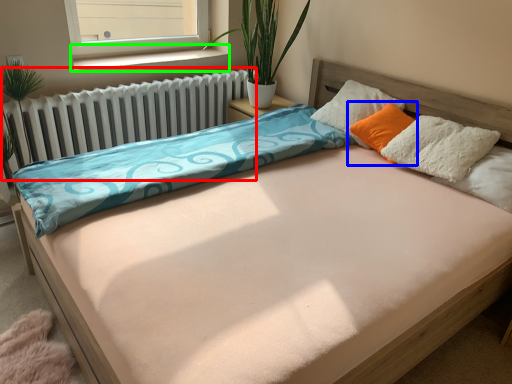
Question: Estimate the real-world distances between objects in this image. Which object is farther from radiator (highlighted by a red box), pillow (highlighted by a blue box) or window sill (highlighted by a green box)?

Choices:
 (A) pillow
 (B) window sill

Answer: (A)